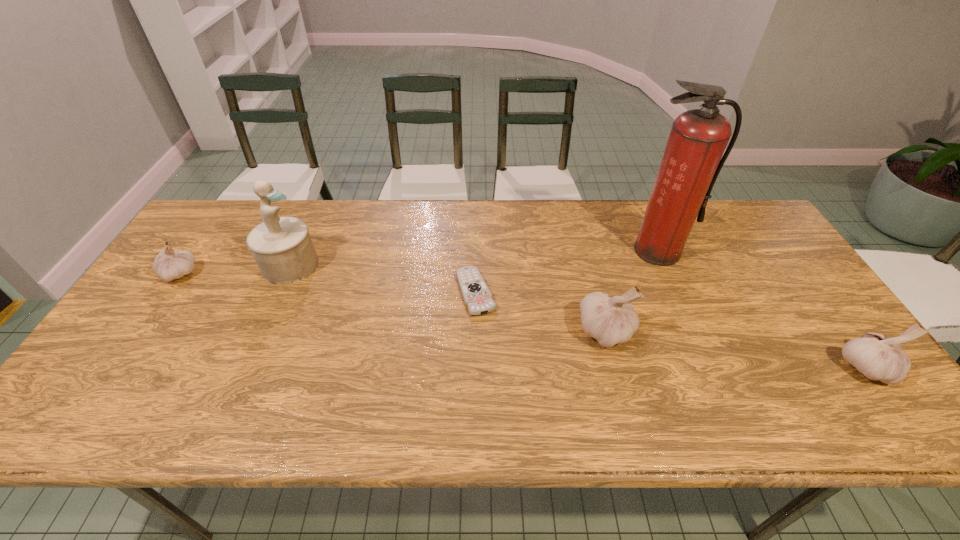
Select which garlic is the closest to the second garlic from left to right. Please provide its 2D coordinates. Your answer should be formatted as a tuple, i.e. [(x, y)], where the tuple contains the x and y coordinates of a point satisfying the conditions above.

[(877, 357)]

The width and height of the screenshot is (960, 540). I want to click on free spot that satisfies the following two spatial constraints: 1. on the front side of the rightmost garlic; 2. on the right side of the remote control, so click(475, 367).

You are a GUI agent. You are given a task and a screenshot of the screen. Output one action in this format:
    pyautogui.click(x=<x>, y=<y>)
    Task: Click on the free space that satisfies the following two spatial constraints: 1. on the front side of the leftmost garlic; 2. on the left side of the second shortest garlic
    Image resolution: width=960 pixels, height=540 pixels.
    Given the screenshot: What is the action you would take?
    pyautogui.click(x=116, y=367)

Identify the location of vacant space that satisfies the following two spatial constraints: 1. at the beak of the second tallest object; 2. on the front side of the leftmost garlic. (286, 274).

Find the location of a particular element. vacant space that satisfies the following two spatial constraints: 1. on the front side of the second garlic from left to right; 2. on the right side of the rightmost garlic is located at coordinates (615, 367).